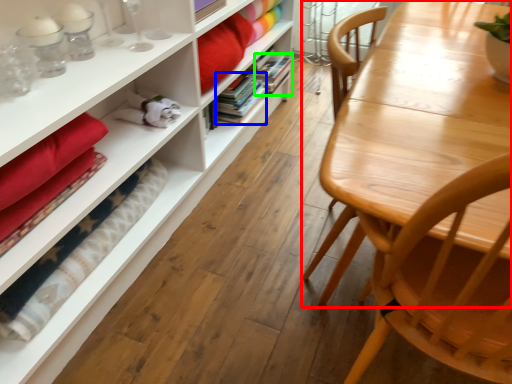
Question: Which object is positioned farthest from table (highlighted by a red box)? Select from book (highlighted by a blue box) and book (highlighted by a green box).

Choices:
 (A) book
 (B) book

Answer: (B)